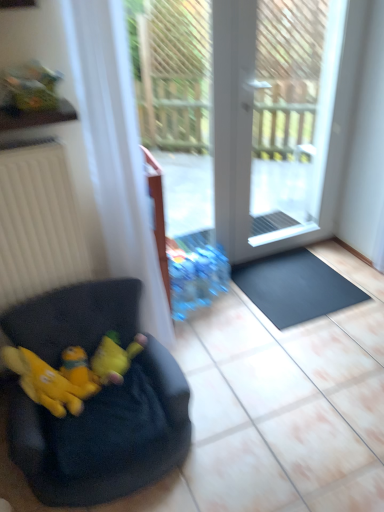
Question: Is the position of black fabric bean bag at lower left more distant than that of yellow plush toy at lower left, the second animal positioned from the left?

Choices:
 (A) no
 (B) yes

Answer: (A)

Question: Is yellow plush toy at lower left, marked as the 1th animal in a right-to-left arrangement, at the back of black fabric bean bag at lower left?

Choices:
 (A) yes
 (B) no

Answer: (A)

Question: From the image's perspective, is black fabric bean bag at lower left located beneath yellow plush toy at lower left, marked as the 1th animal in a right-to-left arrangement?

Choices:
 (A) yes
 (B) no

Answer: (A)

Question: Does black fabric bean bag at lower left have a smaller size compared to yellow plush toy at lower left, the second animal positioned from the left?

Choices:
 (A) no
 (B) yes

Answer: (A)

Question: Can you see black fabric bean bag at lower left touching yellow plush toy at lower left, marked as the 1th animal in a right-to-left arrangement?

Choices:
 (A) yes
 (B) no

Answer: (B)

Question: From a real-world perspective, is black fabric bean bag at lower left physically below yellow plush toy at lower left, the second animal positioned from the left?

Choices:
 (A) yes
 (B) no

Answer: (A)

Question: Is black rubber doormat at lower right located outside white sheer curtain at left?

Choices:
 (A) no
 (B) yes

Answer: (B)

Question: Does black rubber doormat at lower right have a greater width compared to white sheer curtain at left?

Choices:
 (A) yes
 (B) no

Answer: (A)

Question: Does black rubber doormat at lower right have a smaller size compared to white sheer curtain at left?

Choices:
 (A) no
 (B) yes

Answer: (B)

Question: Would you consider black rubber doormat at lower right to be distant from white sheer curtain at left?

Choices:
 (A) no
 (B) yes

Answer: (A)

Question: Is black rubber doormat at lower right facing away from white sheer curtain at left?

Choices:
 (A) yes
 (B) no

Answer: (B)

Question: From the image's perspective, is black rubber doormat at lower right below white sheer curtain at left?

Choices:
 (A) yes
 (B) no

Answer: (A)

Question: Is yellow plush at left not within yellow plush toy at lower left, which appears as the second animal when viewed from the right?

Choices:
 (A) no
 (B) yes

Answer: (A)